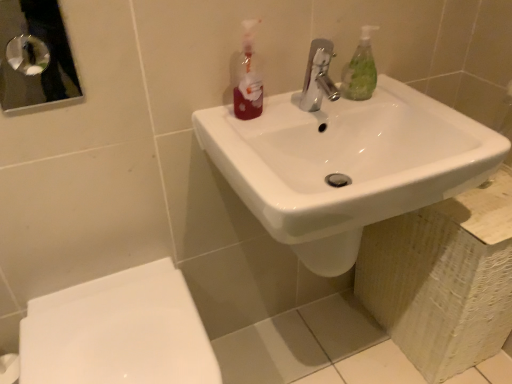
Describe the element at coordinates (360, 70) in the screenshot. I see `green translucent soap dispenser at upper right` at that location.

Find the location of a particular element. green translucent soap dispenser at upper right is located at coordinates pos(360,70).

This screenshot has height=384, width=512. I want to click on white glossy sink at center, so click(346, 164).

In order to face translucent plastic bottle at upper center, should I rotate leftwards or rightwards?

Rotate left and turn 0.954 degrees.

Locate an element on the screen. This screenshot has height=384, width=512. green translucent soap dispenser at upper right is located at coordinates (360, 70).

Can you confirm if polished chrome faucet at center is positioned to the right of white glossy sink at center?

In fact, polished chrome faucet at center is to the left of white glossy sink at center.

Which of these two, polished chrome faucet at center or white glossy sink at center, is wider?

white glossy sink at center is wider.

In the image, is polished chrome faucet at center positioned in front of or behind white glossy sink at center?

Visually, polished chrome faucet at center is located behind white glossy sink at center.

Is polished chrome faucet at center oriented away from white glossy sink at center?

polished chrome faucet at center does not have its back to white glossy sink at center.

From the picture: Could you tell me if white glossy toilet at lower left is facing white glossy sink at center?

No, white glossy toilet at lower left is not turned towards white glossy sink at center.

Which object is further away from the camera, white glossy toilet at lower left or white glossy sink at center?

Positioned behind is white glossy toilet at lower left.

Would you say white glossy toilet at lower left is inside or outside white glossy sink at center?

white glossy toilet at lower left exists outside the volume of white glossy sink at center.

Is white glossy toilet at lower left thinner than white glossy sink at center?

No, white glossy toilet at lower left is not thinner than white glossy sink at center.

Looking at their sizes, would you say translucent plastic bottle at upper center is wider or thinner than white glossy toilet at lower left?

translucent plastic bottle at upper center is thinner than white glossy toilet at lower left.

Does translucent plastic bottle at upper center turn towards white glossy toilet at lower left?

No, translucent plastic bottle at upper center is not aimed at white glossy toilet at lower left.

Which point is more forward, (243, 119) or (89, 351)?

The point (89, 351) is in front.

Consider the image. From a real-world perspective, is translucent plastic bottle at upper center below white glossy toilet at lower left?

No, from a real-world perspective, translucent plastic bottle at upper center is not below white glossy toilet at lower left.

Is white glossy toilet at lower left beside translucent plastic bottle at upper center?

No, white glossy toilet at lower left is not making contact with translucent plastic bottle at upper center.

Is white glossy toilet at lower left not within translucent plastic bottle at upper center?

Yes, white glossy toilet at lower left is outside of translucent plastic bottle at upper center.

Looking at this image, from a real-world perspective, is white glossy toilet at lower left beneath translucent plastic bottle at upper center?

Yes, from a real-world perspective, white glossy toilet at lower left is under translucent plastic bottle at upper center.

Does white glossy toilet at lower left appear on the left side of translucent plastic bottle at upper center?

Indeed, white glossy toilet at lower left is positioned on the left side of translucent plastic bottle at upper center.

Considering the sizes of objects white glossy toilet at lower left and green translucent soap dispenser at upper right in the image provided, who is shorter, white glossy toilet at lower left or green translucent soap dispenser at upper right?

green translucent soap dispenser at upper right.

From the image's perspective, is white glossy toilet at lower left located above green translucent soap dispenser at upper right?

Actually, white glossy toilet at lower left appears below green translucent soap dispenser at upper right in the image.

Is point (98, 351) closer to viewer compared to point (343, 84)?

Yes, point (98, 351) is closer to viewer.

Does white glossy toilet at lower left have a lesser width compared to green translucent soap dispenser at upper right?

No.

Is polished chrome faucet at center to the left of green translucent soap dispenser at upper right from the viewer's perspective?

Correct, you'll find polished chrome faucet at center to the left of green translucent soap dispenser at upper right.

In the scene shown: Is polished chrome faucet at center oriented towards green translucent soap dispenser at upper right?

No, polished chrome faucet at center does not turn towards green translucent soap dispenser at upper right.

Between polished chrome faucet at center and green translucent soap dispenser at upper right, which one has smaller width?

green translucent soap dispenser at upper right.

From the picture: Considering the relative sizes of polished chrome faucet at center and green translucent soap dispenser at upper right in the image provided, is polished chrome faucet at center shorter than green translucent soap dispenser at upper right?

Indeed, polished chrome faucet at center has a lesser height compared to green translucent soap dispenser at upper right.

Identify the location of cleaning product that is above the polished chrome faucet at center (from a real-world perspective). The height and width of the screenshot is (384, 512). (248, 80).

Considering the relative positions of polished chrome faucet at center and translucent plastic bottle at upper center in the image provided, is polished chrome faucet at center to the left of translucent plastic bottle at upper center from the viewer's perspective?

No.

From the picture: Who is smaller, polished chrome faucet at center or translucent plastic bottle at upper center?

Smaller between the two is translucent plastic bottle at upper center.

Where is `tap that appears above the white glossy sink at center (from the image's perspective)`? tap that appears above the white glossy sink at center (from the image's perspective) is located at coordinates (318, 76).

I want to click on toilet that appears behind the white glossy sink at center, so click(118, 332).

Which object lies nearer to the anchor point green translucent soap dispenser at upper right, polished chrome faucet at center or white glossy toilet at lower left?

The object closer to green translucent soap dispenser at upper right is polished chrome faucet at center.

Estimate the real-world distances between objects in this image. Which object is further from green translucent soap dispenser at upper right, white glossy sink at center or translucent plastic bottle at upper center?

translucent plastic bottle at upper center is positioned further to the anchor green translucent soap dispenser at upper right.

Looking at the image, which one is located further to polished chrome faucet at center, translucent plastic bottle at upper center or white glossy sink at center?

Based on the image, white glossy sink at center appears to be further to polished chrome faucet at center.

Estimate the real-world distances between objects in this image. Which object is further from white glossy toilet at lower left, metallic rectangular mirror at upper left or polished chrome faucet at center?

metallic rectangular mirror at upper left lies further to white glossy toilet at lower left than the other object.

When comparing their distances from metallic rectangular mirror at upper left, does polished chrome faucet at center or green translucent soap dispenser at upper right seem further?

green translucent soap dispenser at upper right is further to metallic rectangular mirror at upper left.

Estimate the real-world distances between objects in this image. Which object is further from white glossy toilet at lower left, green translucent soap dispenser at upper right or translucent plastic bottle at upper center?

Among the two, green translucent soap dispenser at upper right is located further to white glossy toilet at lower left.

Looking at the image, which one is located closer to white glossy toilet at lower left, translucent plastic bottle at upper center or green translucent soap dispenser at upper right?

translucent plastic bottle at upper center lies closer to white glossy toilet at lower left than the other object.

From the picture: From the image, which object appears to be farther from white glossy toilet at lower left, metallic rectangular mirror at upper left or white glossy sink at center?

Among the two, metallic rectangular mirror at upper left is located further to white glossy toilet at lower left.

The width and height of the screenshot is (512, 384). I want to click on tap between green translucent soap dispenser at upper right and white glossy sink at center vertically, so click(318, 76).

This screenshot has height=384, width=512. Identify the location of cleaning product located between metallic rectangular mirror at upper left and green translucent soap dispenser at upper right in the left-right direction. (248, 80).

Where is `sink between green translucent soap dispenser at upper right and white glossy toilet at lower left in the vertical direction`? The width and height of the screenshot is (512, 384). sink between green translucent soap dispenser at upper right and white glossy toilet at lower left in the vertical direction is located at coordinates (346, 164).

The height and width of the screenshot is (384, 512). Find the location of `tap between translucent plastic bottle at upper center and green translucent soap dispenser at upper right from left to right`. tap between translucent plastic bottle at upper center and green translucent soap dispenser at upper right from left to right is located at coordinates (318, 76).